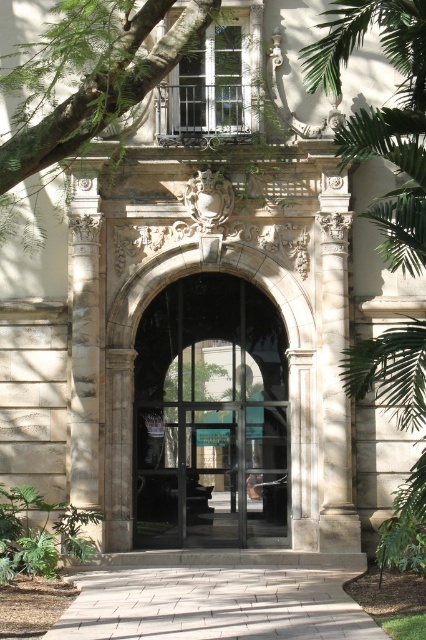
Question: Is clear glass door at center to the left of green leafy tree at upper left from the viewer's perspective?

Choices:
 (A) no
 (B) yes

Answer: (A)

Question: Which point is farther from the camera taking this photo?

Choices:
 (A) (199, 513)
 (B) (112, 116)
 (C) (411, 240)

Answer: (A)

Question: Which object is farther from the camera taking this photo?

Choices:
 (A) green leafy tree at right
 (B) clear glass door at center
 (C) green leafy tree at upper left

Answer: (B)

Question: Is clear glass door at center positioned in front of green leafy tree at right?

Choices:
 (A) yes
 (B) no

Answer: (B)

Question: Does clear glass door at center have a larger size compared to green leafy tree at right?

Choices:
 (A) no
 (B) yes

Answer: (A)

Question: Estimate the real-world distances between objects in this image. Which object is farther from the green leafy tree at upper left?

Choices:
 (A) green leafy tree at right
 (B) clear glass door at center

Answer: (B)